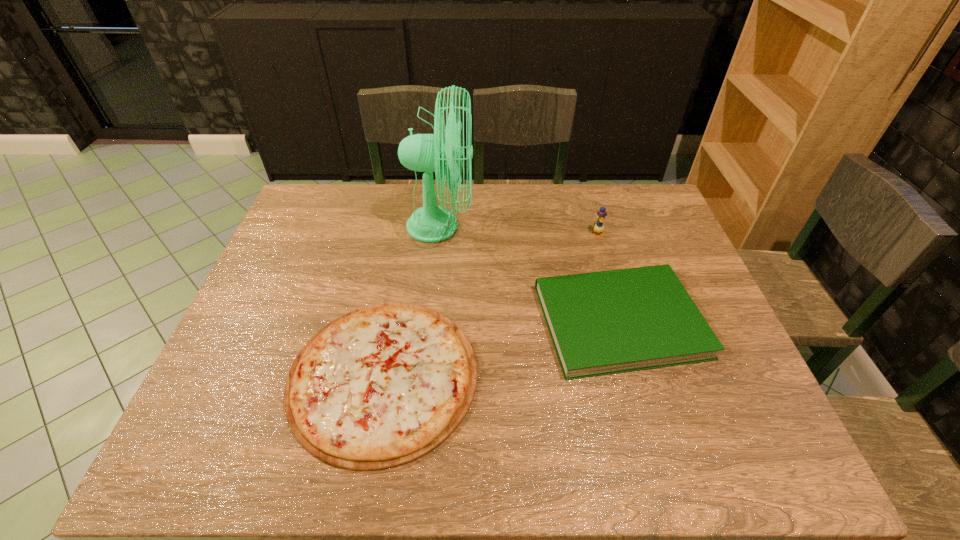
This screenshot has height=540, width=960. What are the coordinates of `blank region between the tallest object and the paperback book` in the screenshot? It's located at (530, 274).

The width and height of the screenshot is (960, 540). I want to click on free space between the third shortest object and the pizza, so click(x=491, y=305).

What are the coordinates of `free space between the paperback book and the pizza` in the screenshot? It's located at (501, 348).

This screenshot has width=960, height=540. Identify the location of empty space that is in between the tallest object and the duckling. (518, 230).

Locate an element on the screen. The height and width of the screenshot is (540, 960). free space between the tallest object and the second shortest object is located at coordinates (530, 274).

Where is `free area in between the tallest object and the second tallest object`? free area in between the tallest object and the second tallest object is located at coordinates (518, 230).

This screenshot has height=540, width=960. Identify the location of vacant space in between the pizza and the second tallest object. (491, 305).

You are a GUI agent. You are given a task and a screenshot of the screen. Output one action in this format:
    pyautogui.click(x=<x>, y=<y>)
    Task: Click on the third closest object relative to the pizza
    The width and height of the screenshot is (960, 540).
    Given the screenshot: What is the action you would take?
    pyautogui.click(x=598, y=227)

Locate which object ranks second in proximity to the tallest object. Please provide its 2D coordinates. Your answer should be formatted as a tuple, i.e. [(x, y)], where the tuple contains the x and y coordinates of a point satisfying the conditions above.

[(608, 322)]

At what (x,y) coordinates should I click in order to perform the action: click on free region that satisfies the following two spatial constraints: 1. in front of the tallest object to blow air; 2. on the left side of the paperback book. Please return your answer as a coordinate pair (x, y). Looking at the image, I should click on (431, 321).